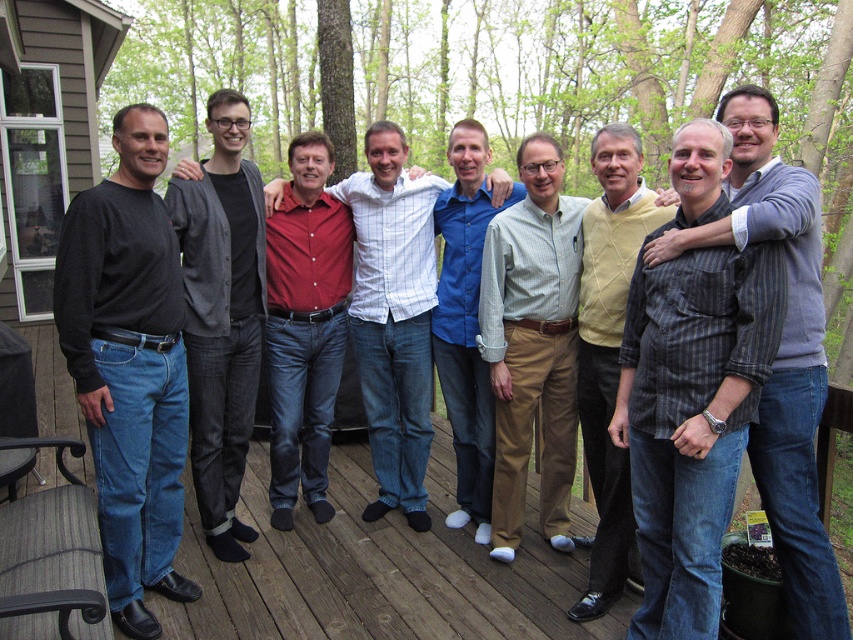
Question: Among these points, which one is nearest to the camera?

Choices:
 (A) (231, 224)
 (B) (802, 468)
 (C) (149, 180)
 (D) (497, 227)

Answer: (B)

Question: Which point is farther from the camera taking this photo?

Choices:
 (A) (216, 193)
 (B) (602, 131)
 (C) (294, 412)
 (D) (490, 218)

Answer: (C)

Question: Is light green checkered shirt at center to the left of dark gray cardigan at center from the viewer's perspective?

Choices:
 (A) yes
 (B) no

Answer: (B)

Question: Is black cotton shirt at left wider than yellow sweater at center?

Choices:
 (A) yes
 (B) no

Answer: (B)

Question: Can you confirm if red shirt at center is smaller than blue cotton shirt at center?

Choices:
 (A) no
 (B) yes

Answer: (A)

Question: Which object appears farthest from the camera in this image?

Choices:
 (A) light green checkered shirt at center
 (B) black cotton shirt at left

Answer: (A)